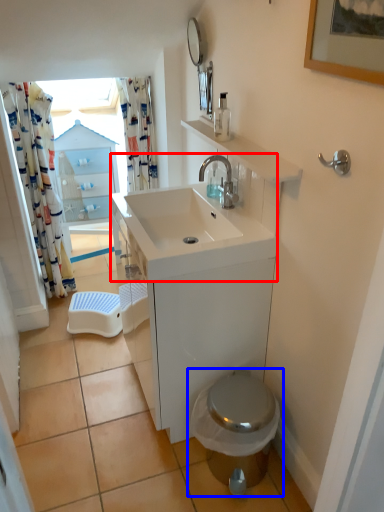
Question: Which of the following is the farthest to the observer, sink (highlighted by a red box) or toilet (highlighted by a blue box)?

Choices:
 (A) sink
 (B) toilet

Answer: (B)